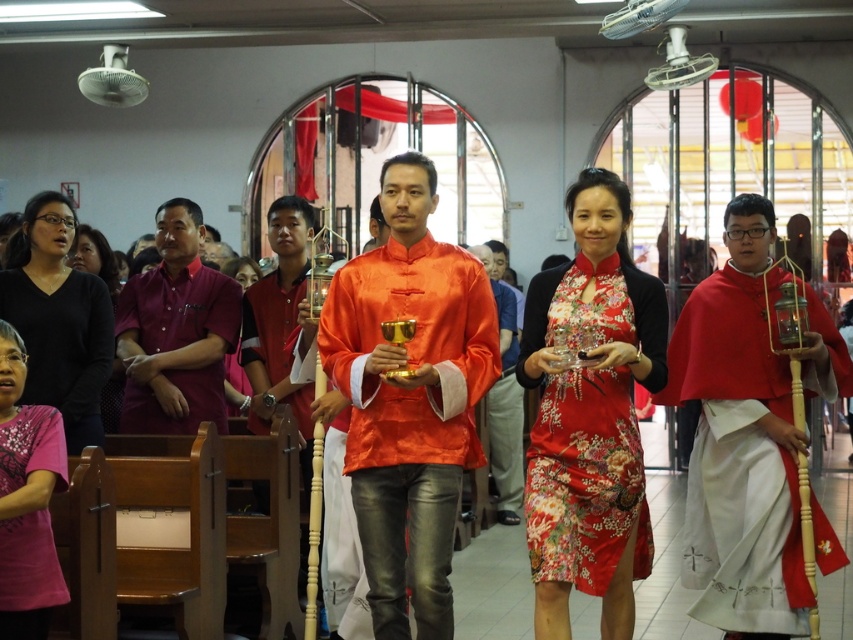
Locate an element on the screen. This screenshot has width=853, height=640. matte red cape at center is located at coordinates (740, 442).

Can you confirm if matte red cape at center is positioned below pink matte shirt at lower left?

No, matte red cape at center is not below pink matte shirt at lower left.

Between point (715, 545) and point (4, 433), which one is positioned behind?

Point (715, 545)

Find the location of `matte red cape at center`. matte red cape at center is located at coordinates (740, 442).

Is the position of matte red cape at center less distant than that of black matte dress at lower left?

No, it is behind black matte dress at lower left.

Consider the image. How much distance is there between matte red cape at center and black matte dress at lower left?

The distance of matte red cape at center from black matte dress at lower left is 4.47 meters.

Identify the location of matte red cape at center. The image size is (853, 640). (740, 442).

Does silky orange robe at center appear over matte black glasses at upper left?

No.

Which is above, silky orange robe at center or matte black glasses at upper left?

matte black glasses at upper left is above.

Is point (509, 337) farther from camera compared to point (107, 248)?

Yes.

At what (x,y) coordinates should I click in order to perform the action: click on silky orange robe at center. Please return your answer as a coordinate pair (x, y). Looking at the image, I should click on (503, 401).